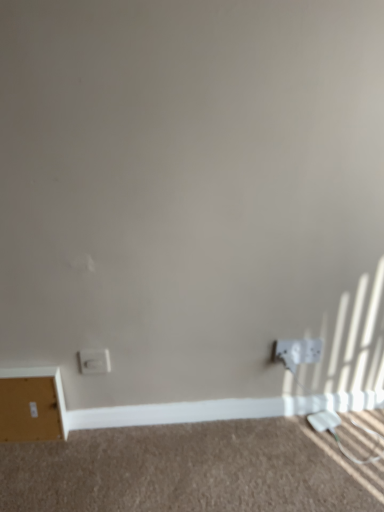
Question: Is white plastic power outlet at lower right a part of white plastic socket at lower left, the second power plugs and sockets positioned from the right?

Choices:
 (A) yes
 (B) no

Answer: (B)

Question: Does white plastic socket at lower left, which ranks as the 1th power plugs and sockets in left-to-right order, turn towards white plastic power outlet at lower right?

Choices:
 (A) yes
 (B) no

Answer: (B)

Question: Is white plastic power outlet at lower right at the back of white plastic socket at lower left, the second power plugs and sockets positioned from the right?

Choices:
 (A) yes
 (B) no

Answer: (B)

Question: Is white plastic socket at lower left, which ranks as the 1th power plugs and sockets in left-to-right order, positioned beyond the bounds of white plastic power outlet at lower right?

Choices:
 (A) yes
 (B) no

Answer: (A)

Question: Is white plastic socket at lower left, which ranks as the 1th power plugs and sockets in left-to-right order, taller than white plastic power outlet at lower right?

Choices:
 (A) no
 (B) yes

Answer: (B)

Question: Considering the positions of white matte file cabinet at lower left and white plastic socket at lower left, which ranks as the 1th power plugs and sockets in left-to-right order, in the image, is white matte file cabinet at lower left wider or thinner than white plastic socket at lower left, which ranks as the 1th power plugs and sockets in left-to-right order,?

Choices:
 (A) thin
 (B) wide

Answer: (B)

Question: Would you say white matte file cabinet at lower left is to the left or to the right of white plastic socket at lower left, the second power plugs and sockets positioned from the right, in the picture?

Choices:
 (A) right
 (B) left

Answer: (B)

Question: Does point (59, 419) appear closer or farther from the camera than point (92, 366)?

Choices:
 (A) farther
 (B) closer

Answer: (A)

Question: From a real-world perspective, is white matte file cabinet at lower left positioned above or below white plastic socket at lower left, the second power plugs and sockets positioned from the right?

Choices:
 (A) below
 (B) above

Answer: (A)

Question: From the image's perspective, is beige carpet at lower center above or below white plastic power plugs and sockets at lower right, which ranks as the first power plugs and sockets in right-to-left order?

Choices:
 (A) above
 (B) below

Answer: (B)

Question: Looking at their shapes, would you say beige carpet at lower center is wider or thinner than white plastic power plugs and sockets at lower right, which ranks as the first power plugs and sockets in right-to-left order?

Choices:
 (A) thin
 (B) wide

Answer: (B)

Question: Would you say beige carpet at lower center is to the left or to the right of white plastic power plugs and sockets at lower right, which ranks as the first power plugs and sockets in right-to-left order, in the picture?

Choices:
 (A) left
 (B) right

Answer: (A)

Question: Is beige carpet at lower center in front of or behind white plastic power plugs and sockets at lower right, acting as the 2th power plugs and sockets starting from the left, in the image?

Choices:
 (A) behind
 (B) front

Answer: (B)

Question: Is point (311, 347) positioned closer to the camera than point (281, 349)?

Choices:
 (A) closer
 (B) farther

Answer: (B)

Question: Considering the positions of white plastic power plugs and sockets at lower right, which ranks as the first power plugs and sockets in right-to-left order, and white plastic power outlet at lower right in the image, is white plastic power plugs and sockets at lower right, which ranks as the first power plugs and sockets in right-to-left order, wider or thinner than white plastic power outlet at lower right?

Choices:
 (A) thin
 (B) wide

Answer: (A)